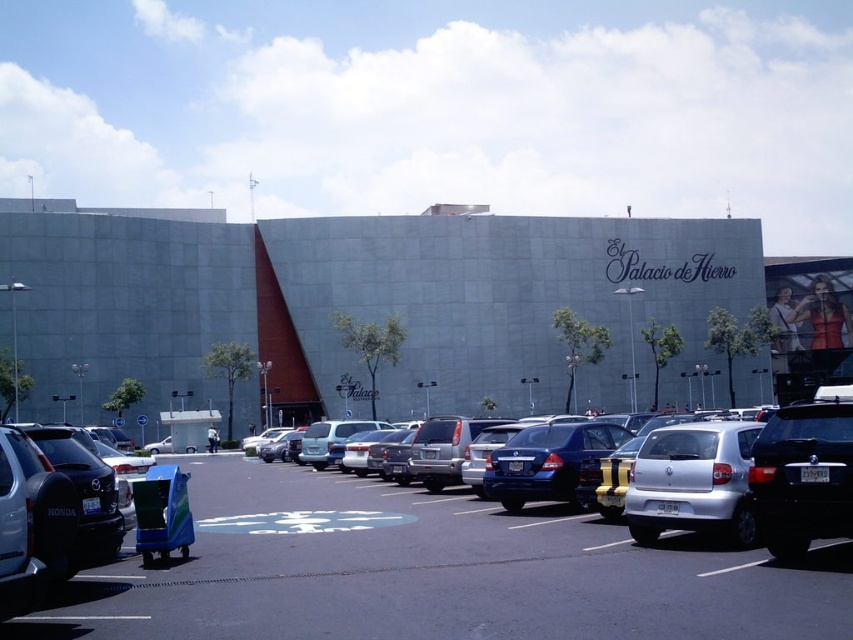
Does gray concrete building at center have a smaller size compared to silver metallic sedan at center?

Actually, gray concrete building at center might be larger than silver metallic sedan at center.

Is gray concrete building at center further to the viewer compared to silver metallic sedan at center?

Yes, it is.

Measure the distance between gray concrete building at center and camera.

gray concrete building at center and camera are 63.85 meters apart from each other.

Locate an element on the screen. Image resolution: width=853 pixels, height=640 pixels. gray concrete building at center is located at coordinates (366, 304).

What do you see at coordinates (366, 304) in the screenshot? This screenshot has height=640, width=853. I see `gray concrete building at center` at bounding box center [366, 304].

In order to click on gray concrete building at center in this screenshot , I will do `click(366, 304)`.

The width and height of the screenshot is (853, 640). I want to click on gray concrete building at center, so click(366, 304).

Is smooth asphalt parking lot at center behind silver metallic sedan at center?

No, smooth asphalt parking lot at center is in front of silver metallic sedan at center.

What do you see at coordinates (433, 573) in the screenshot? I see `smooth asphalt parking lot at center` at bounding box center [433, 573].

Is point (300, 577) farther from viewer compared to point (714, 500)?

No, (300, 577) is in front of (714, 500).

Locate an element on the screen. This screenshot has width=853, height=640. smooth asphalt parking lot at center is located at coordinates (433, 573).